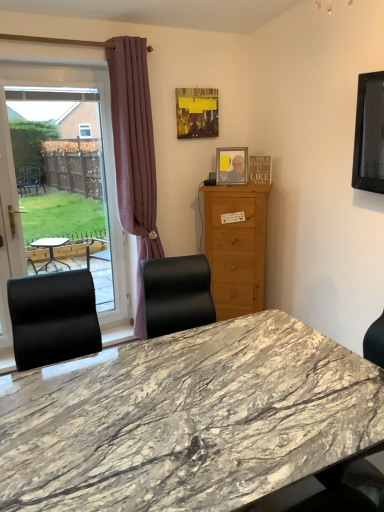
Question: From their relative heights in the image, would you say matte yellow picture frame at upper center, the first picture frame viewed from the top, is taller or shorter than matte white screen door at left?

Choices:
 (A) tall
 (B) short

Answer: (B)

Question: From the image's perspective, relative to matte white screen door at left, is matte yellow picture frame at upper center, positioned as the 1th picture frame in left-to-right order, above or below?

Choices:
 (A) above
 (B) below

Answer: (A)

Question: Estimate the real-world distances between objects in this image. Which object is closer to the marble table at center?

Choices:
 (A) light brown wood cabinet at center
 (B) matte plastic picture frame at upper center, which appears as the second picture frame when viewed from the top
 (C) matte white screen door at left
 (D) transparent glass window at left
 (E) matte yellow picture frame at upper center, which is counted as the second picture frame, starting from the right

Answer: (A)

Question: Estimate the real-world distances between objects in this image. Which object is farther from the marble table at center?

Choices:
 (A) matte yellow picture frame at upper center, the 2th picture frame ordered from the bottom
 (B) matte white screen door at left
 (C) light brown wood cabinet at center
 (D) mauve velvet curtain at left
 (E) transparent glass window at left

Answer: (A)